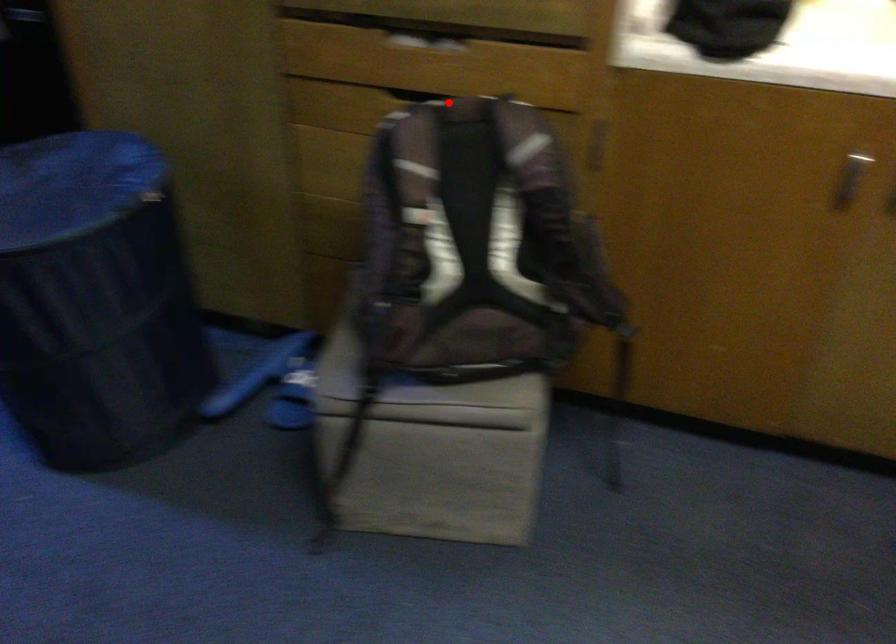
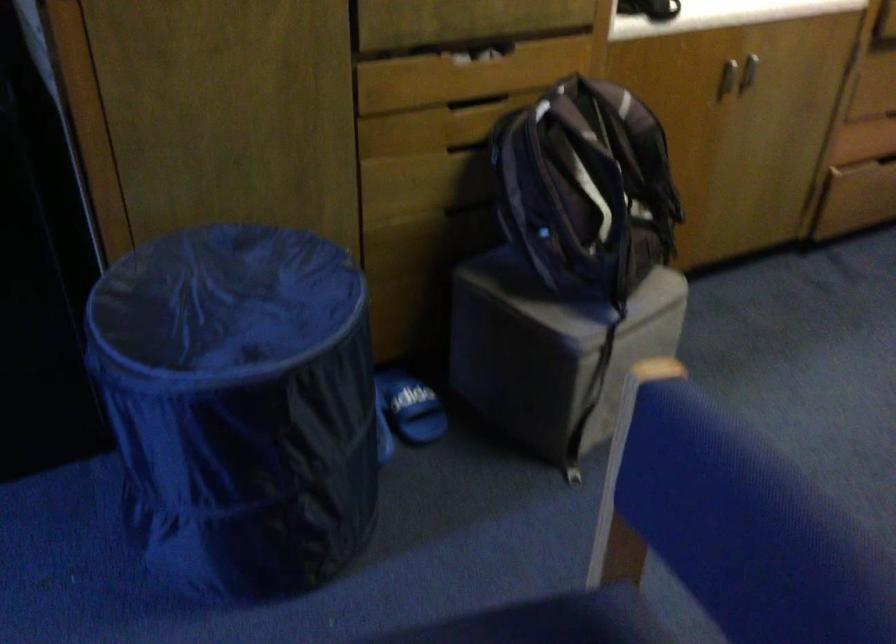
Find the pixel in the second image that matches the highlighted location in the first image.

(476, 102)